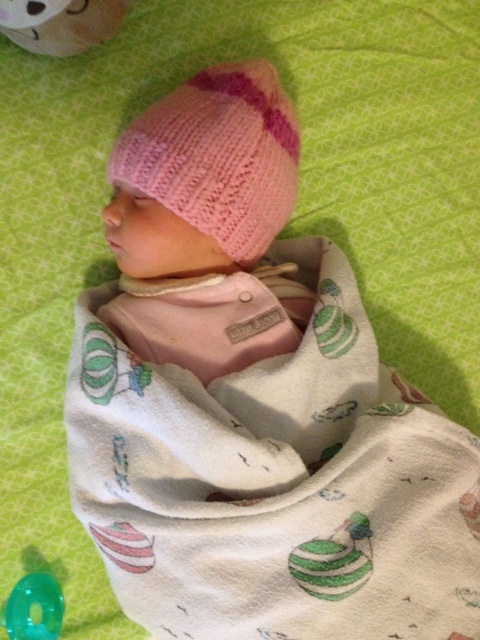
Can you confirm if white cotton swaddle at center is positioned to the left of pink knitted hat at upper center?

Incorrect, white cotton swaddle at center is not on the left side of pink knitted hat at upper center.

Which of these two, white cotton swaddle at center or pink knitted hat at upper center, stands taller?

white cotton swaddle at center

Who is more forward, (372, 522) or (266, 77)?

Point (372, 522) is more forward.

Find the location of `white cotton swaddle at center`. white cotton swaddle at center is located at coordinates (275, 483).

How distant is white cotton swaddle at center from translucent green ring at lower left?

A distance of 42.04 centimeters exists between white cotton swaddle at center and translucent green ring at lower left.

Between white cotton swaddle at center and translucent green ring at lower left, which one has more height?

With more height is white cotton swaddle at center.

Which is behind, point (218, 508) or point (50, 588)?

The point (50, 588) is behind.

Identify the location of white cotton swaddle at center. The width and height of the screenshot is (480, 640). (275, 483).

Is point (264, 156) farther from viewer compared to point (44, 605)?

No.

Looking at this image, does pink knitted hat at upper center appear on the left side of translucent green ring at lower left?

In fact, pink knitted hat at upper center is to the right of translucent green ring at lower left.

The image size is (480, 640). In order to click on pink knitted hat at upper center in this screenshot , I will do `click(217, 156)`.